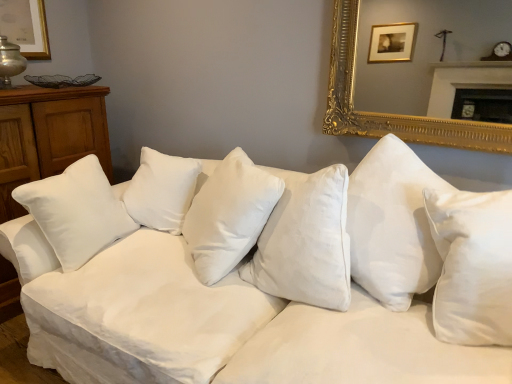
Locate an element on the screen. The height and width of the screenshot is (384, 512). white satin pillow at center is located at coordinates (229, 215).

The height and width of the screenshot is (384, 512). What do you see at coordinates (229, 215) in the screenshot?
I see `white satin pillow at center` at bounding box center [229, 215].

Image resolution: width=512 pixels, height=384 pixels. Describe the element at coordinates (260, 280) in the screenshot. I see `white cotton couch at center` at that location.

You are a GUI agent. You are given a task and a screenshot of the screen. Output one action in this format:
    pyautogui.click(x=<x>, y=<y>)
    Task: Click on the white cotton couch at center
    The width and height of the screenshot is (512, 384).
    Given the screenshot: What is the action you would take?
    pyautogui.click(x=260, y=280)

At what (x,y) coordinates should I click in order to perform the action: click on white satin pillow at center. Please return your answer as a coordinate pair (x, y). Image resolution: width=512 pixels, height=384 pixels. Looking at the image, I should click on (229, 215).

Would you say white cotton couch at center is to the left or to the right of white satin pillow at center in the picture?

white cotton couch at center is to the right of white satin pillow at center.

Which object is closer to the camera, white cotton couch at center or white satin pillow at center?

white cotton couch at center is more forward.

Is point (115, 308) closer to viewer compared to point (259, 213)?

That is True.

From the image's perspective, is white cotton couch at center located beneath white satin pillow at center?

Indeed, from the image's perspective, white cotton couch at center is shown beneath white satin pillow at center.

From a real-world perspective, is white cotton couch at center physically below white satin pillow at center?

Indeed, from a real-world perspective, white cotton couch at center is positioned beneath white satin pillow at center.

Looking at this image, considering the relative sizes of white cotton couch at center and white satin pillow at center in the image provided, is white cotton couch at center thinner than white satin pillow at center?

Incorrect, the width of white cotton couch at center is not less than that of white satin pillow at center.

Which of these two, white cotton couch at center or white satin pillow at center, stands taller?

With more height is white cotton couch at center.

Is white cotton couch at center smaller than white satin pillow at center?

Actually, white cotton couch at center might be larger than white satin pillow at center.

Which is correct: white cotton couch at center is inside white satin pillow at center, or outside of it?

white cotton couch at center is spatially situated outside white satin pillow at center.

Are white cotton couch at center and white satin pillow at center making contact?

There is a gap between white cotton couch at center and white satin pillow at center.

Is white cotton couch at center oriented away from white satin pillow at center?

Correct, white cotton couch at center is looking away from white satin pillow at center.

How many degrees apart are the facing directions of white cotton couch at center and white satin pillow at center?

39.9 degrees separate the facing orientations of white cotton couch at center and white satin pillow at center.

At what (x,y) coordinates should I click in order to perform the action: click on studio couch that is in front of the white satin pillow at center. Please return your answer as a coordinate pair (x, y). This screenshot has height=384, width=512. Looking at the image, I should click on (260, 280).

Considering the relative positions of white satin pillow at center and white cotton couch at center in the image provided, is white satin pillow at center to the left of white cotton couch at center from the viewer's perspective?

Yes.

Is white satin pillow at center in front of or behind white cotton couch at center in the image?

white satin pillow at center is positioned farther from the viewer than white cotton couch at center.

Which is less distant, [206,272] or [279,252]?

Positioned in front is point [279,252].

From the image's perspective, is white satin pillow at center located above or below white cotton couch at center?

Based on their image positions, white satin pillow at center is located above white cotton couch at center.

From a real-world perspective, is white satin pillow at center physically below white cotton couch at center?

Actually, white satin pillow at center is physically above white cotton couch at center in the real world.

Does white satin pillow at center have a lesser width compared to white cotton couch at center?

Indeed, white satin pillow at center has a lesser width compared to white cotton couch at center.

Is white satin pillow at center taller or shorter than white cotton couch at center?

Clearly, white satin pillow at center is shorter compared to white cotton couch at center.

Is white satin pillow at center bigger than white cotton couch at center?

Actually, white satin pillow at center might be smaller than white cotton couch at center.

Choose the correct answer: Is white satin pillow at center inside white cotton couch at center or outside it?

white satin pillow at center lies within the bounds of white cotton couch at center.

Is white satin pillow at center in contact with white cotton couch at center?

white satin pillow at center and white cotton couch at center are not in contact.

Is white satin pillow at center looking in the opposite direction of white cotton couch at center?

Yes, white satin pillow at center is positioned with its back facing white cotton couch at center.

How many degrees apart are the facing directions of white satin pillow at center and white cotton couch at center?

The angular difference between white satin pillow at center and white cotton couch at center is 39.9 degrees.

Image resolution: width=512 pixels, height=384 pixels. I want to click on studio couch below the white satin pillow at center (from a real-world perspective), so click(x=260, y=280).

Image resolution: width=512 pixels, height=384 pixels. Identify the location of studio couch in front of the white satin pillow at center. (260, 280).

Image resolution: width=512 pixels, height=384 pixels. What are the coordinates of `studio couch beneath the white satin pillow at center (from a real-world perspective)` in the screenshot? It's located at (260, 280).